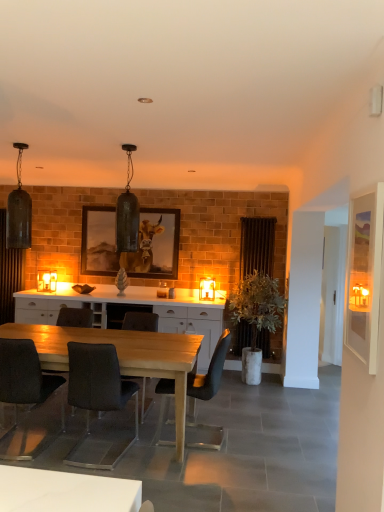
Question: Would you say wooden framed picture of cow at center is inside or outside matte black pendant light at upper left, the second lamp when ordered from left to right?

Choices:
 (A) outside
 (B) inside

Answer: (A)

Question: Is wooden framed picture of cow at center bigger or smaller than matte black pendant light at upper left, acting as the third lamp starting from the back?

Choices:
 (A) small
 (B) big

Answer: (A)

Question: Which of these objects is positioned farthest from the translucent glass candle at center, positioned as the fourth lamp in left-to-right order?

Choices:
 (A) brown wooden radiator at right, which ranks as the 1th curtain in right-to-left order
 (B) dark gray fabric chair at center, the 3th chair viewed from the right
 (C) matte black chair at center, positioned as the 4th chair in left-to-right order
 (D) light wood table at center
 (E) dark gray fabric chair at lower left, which ranks as the first chair in left-to-right order

Answer: (E)

Question: Which of these objects is positioned closest to the matte black chair at center, which is the 1th chair in right-to-left order?

Choices:
 (A) green leafy plant in white pot at center-right
 (B) wooden framed picture of cow at center
 (C) brown wooden radiator at right, the first curtain in the front-to-back sequence
 (D) light wood table at center
 (E) white glossy cabinet at center

Answer: (E)